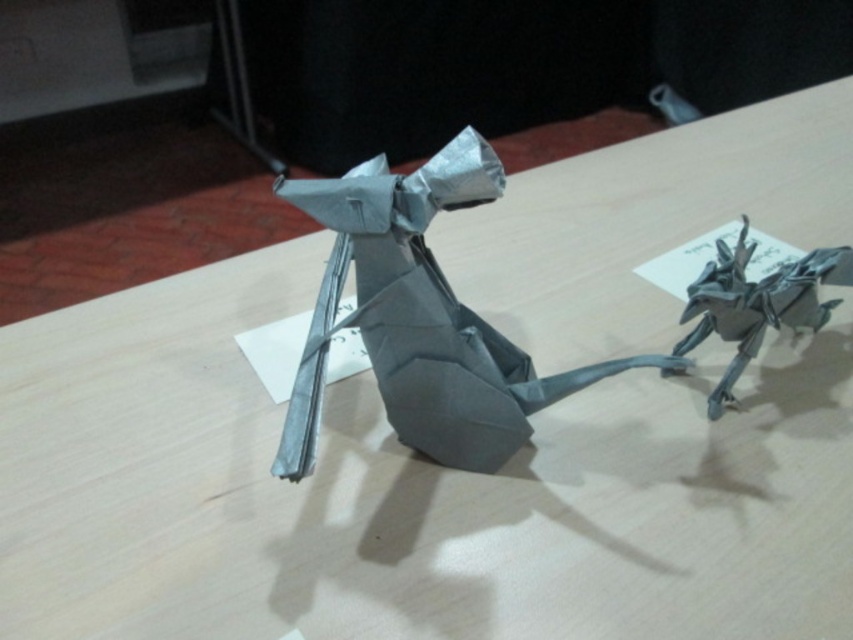
Does point (440, 461) come in front of point (720, 278)?

No, (440, 461) is behind (720, 278).

Can you confirm if gray paper origami mouse at center is positioned to the right of gray metallic origami dragon at right?

No, gray paper origami mouse at center is not to the right of gray metallic origami dragon at right.

From the picture: Who is more forward, (306,381) or (735,252)?

Point (306,381) is in front.

Where is `gray paper origami mouse at center`? Image resolution: width=853 pixels, height=640 pixels. gray paper origami mouse at center is located at coordinates (421, 317).

Between gray metallic origami dragon at right and gray paper at center, which one appears on the left side from the viewer's perspective?

Positioned to the left is gray paper at center.

Is gray metallic origami dragon at right bigger than gray paper at center?

Yes.

Is point (747, 284) positioned behind point (251, 348)?

No.

The height and width of the screenshot is (640, 853). What are the coordinates of `gray metallic origami dragon at right` in the screenshot? It's located at (757, 301).

Where is `gray paper origami mouse at center`? Image resolution: width=853 pixels, height=640 pixels. gray paper origami mouse at center is located at coordinates (421, 317).

Is gray paper origami mouse at center positioned in front of matte gray origami at right?

Yes, it is.

Is point (308, 433) positioned behind point (735, 228)?

That is False.

Locate an element on the screen. gray paper origami mouse at center is located at coordinates (421, 317).